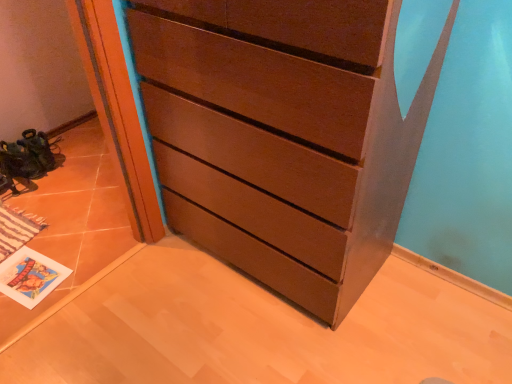
What are the coordinates of `free space on the front side of matte brown chest of drawers at center` in the screenshot? It's located at (282, 340).